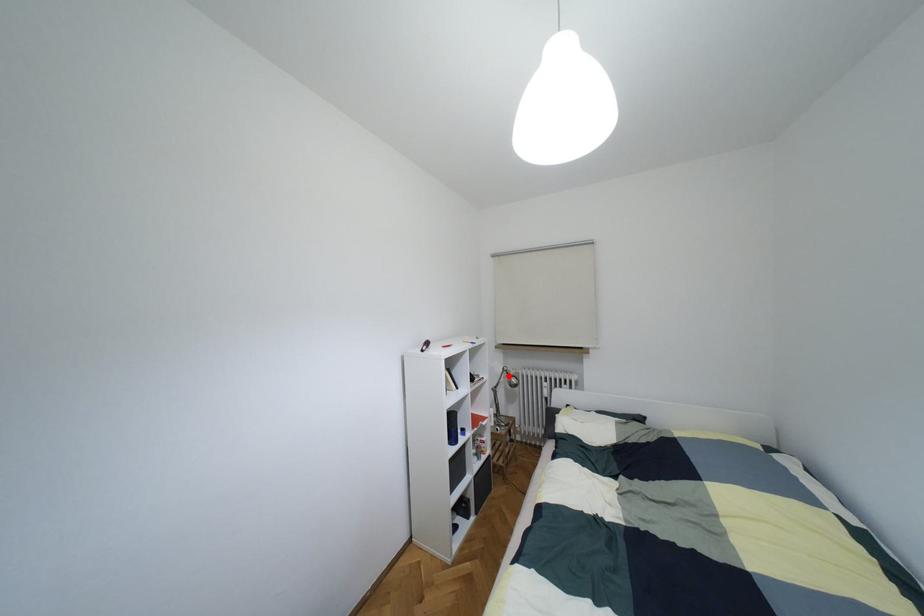
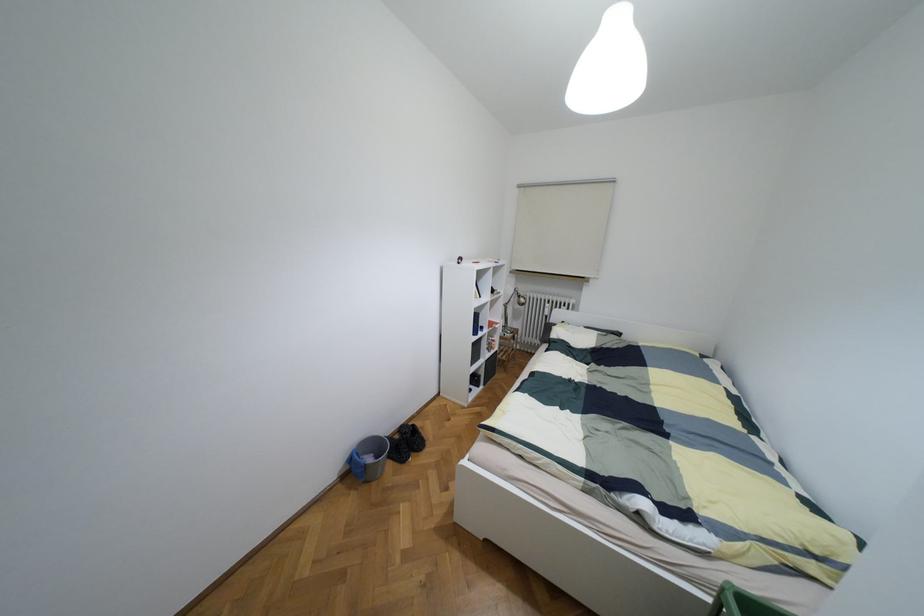
Locate, in the second image, the point that corresponds to the highlighted location in the first image.

(517, 296)